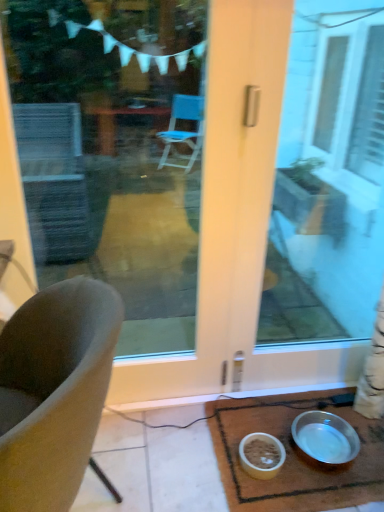
Question: From a real-world perspective, is soft gray cushion at left physically below transparent glass door at center, positioned as the 2th window screen in right-to-left order?

Choices:
 (A) no
 (B) yes

Answer: (B)

Question: Can transparent glass door at center, positioned as the 2th window screen in right-to-left order, be found inside soft gray cushion at left?

Choices:
 (A) no
 (B) yes

Answer: (A)

Question: Considering the relative positions of soft gray cushion at left and transparent glass door at center, the first window screen positioned from the left, in the image provided, is soft gray cushion at left behind transparent glass door at center, the first window screen positioned from the left,?

Choices:
 (A) yes
 (B) no

Answer: (B)

Question: Considering the relative sizes of soft gray cushion at left and transparent glass door at center, positioned as the 2th window screen in right-to-left order, in the image provided, is soft gray cushion at left bigger than transparent glass door at center, positioned as the 2th window screen in right-to-left order,?

Choices:
 (A) no
 (B) yes

Answer: (B)

Question: Is soft gray cushion at left wider than transparent glass door at center, positioned as the 2th window screen in right-to-left order?

Choices:
 (A) yes
 (B) no

Answer: (A)

Question: Is soft gray cushion at left aimed at transparent glass door at center, positioned as the 2th window screen in right-to-left order?

Choices:
 (A) no
 (B) yes

Answer: (A)

Question: Does transparent glass door at center, positioned as the 2th window screen in right-to-left order, lie behind metallic silver bowl at lower right?

Choices:
 (A) yes
 (B) no

Answer: (B)

Question: Does transparent glass door at center, the first window screen positioned from the left, have a smaller size compared to metallic silver bowl at lower right?

Choices:
 (A) no
 (B) yes

Answer: (A)

Question: Is transparent glass door at center, positioned as the 2th window screen in right-to-left order, aimed at metallic silver bowl at lower right?

Choices:
 (A) no
 (B) yes

Answer: (A)

Question: From a real-world perspective, is transparent glass door at center, positioned as the 2th window screen in right-to-left order, on top of metallic silver bowl at lower right?

Choices:
 (A) no
 (B) yes

Answer: (B)

Question: Is transparent glass door at center, positioned as the 2th window screen in right-to-left order, at the right side of metallic silver bowl at lower right?

Choices:
 (A) yes
 (B) no

Answer: (B)

Question: Is transparent glass door at center, the first window screen positioned from the left, not inside metallic silver bowl at lower right?

Choices:
 (A) no
 (B) yes

Answer: (B)

Question: Are metallic silver bowl at lower right and transparent glass door at center, the first window screen positioned from the left, making contact?

Choices:
 (A) no
 (B) yes

Answer: (A)